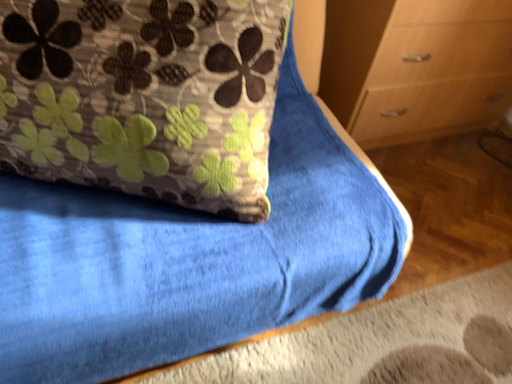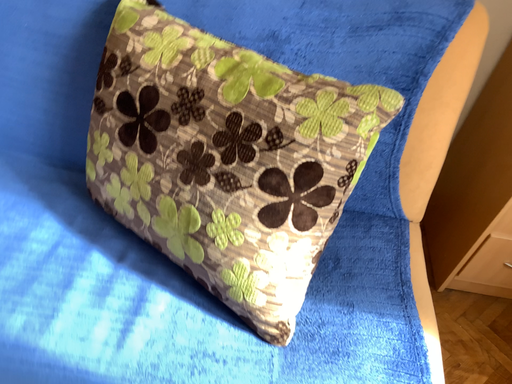
Question: How did the camera likely rotate when shooting the video?

Choices:
 (A) rotated left
 (B) rotated right

Answer: (A)